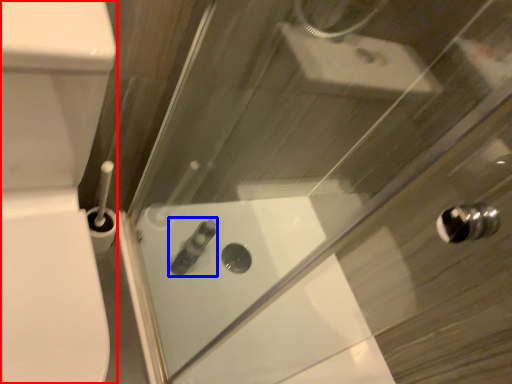
Question: Which object is further to the camera taking this photo, porcelain (highlighted by a red box) or toiletry (highlighted by a blue box)?

Choices:
 (A) porcelain
 (B) toiletry

Answer: (B)